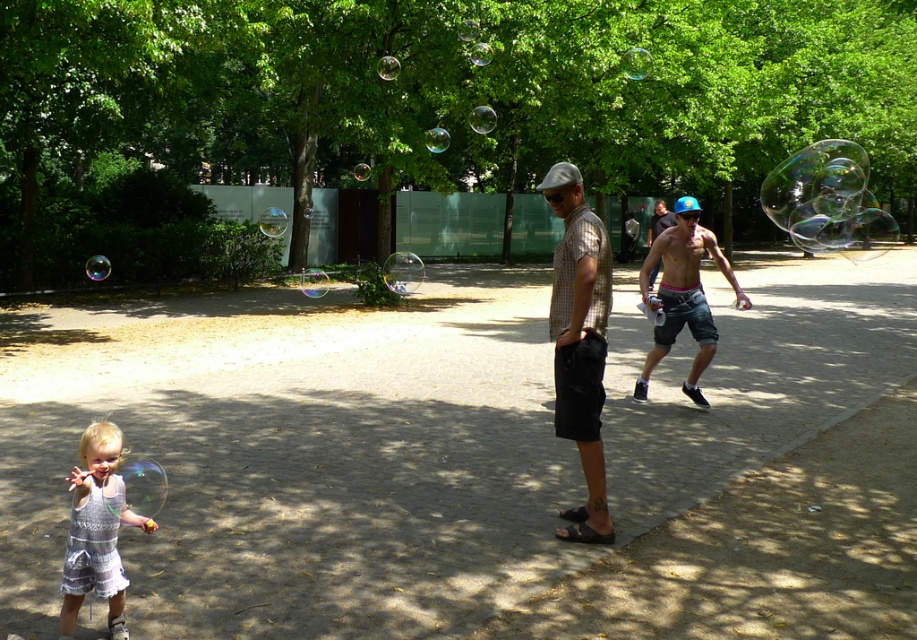
Question: Which of the following is the closest to the observer?

Choices:
 (A) (685, 381)
 (B) (582, 227)

Answer: (B)

Question: Is checkered fabric shirt at center further to camera compared to white lace dress at lower left?

Choices:
 (A) yes
 (B) no

Answer: (A)

Question: Among these points, which one is nearest to the camera?

Choices:
 (A) (668, 259)
 (B) (79, 560)

Answer: (B)

Question: Considering the real-world distances, which object is closest to the white lace dress at lower left?

Choices:
 (A) checkered fabric shirt at center
 (B) shiny blue cap at center

Answer: (A)

Question: Is checkered fabric shirt at center to the right of shiny blue cap at center from the viewer's perspective?

Choices:
 (A) no
 (B) yes

Answer: (A)

Question: Is white lace dress at lower left to the right of shiny blue cap at center from the viewer's perspective?

Choices:
 (A) no
 (B) yes

Answer: (A)